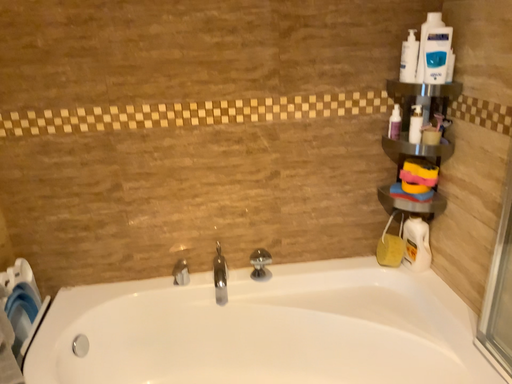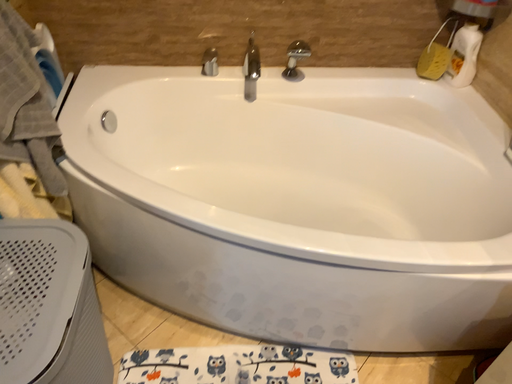
Question: Which way did the camera rotate in the video?

Choices:
 (A) rotated downward
 (B) rotated upward

Answer: (A)